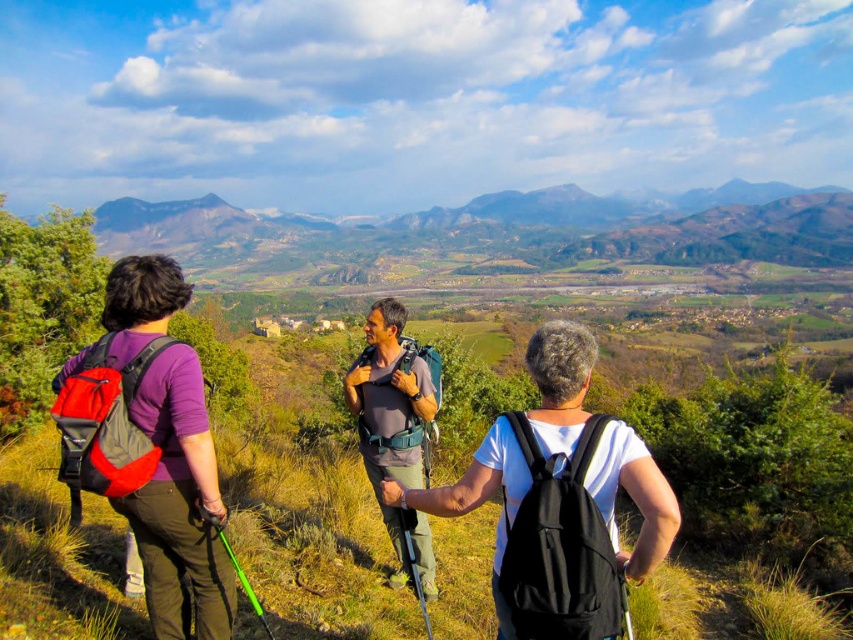
Can you confirm if matte black backpack at center is smaller than matte gray shirt at center?

Actually, matte black backpack at center might be larger than matte gray shirt at center.

Is point (643, 573) closer to camera compared to point (392, 404)?

Yes, point (643, 573) is closer to viewer.

Is point (62, 384) positioned after point (374, 332)?

No, (62, 384) is closer to viewer.

Find the location of a particular element. The height and width of the screenshot is (640, 853). matte black backpack at center is located at coordinates (161, 452).